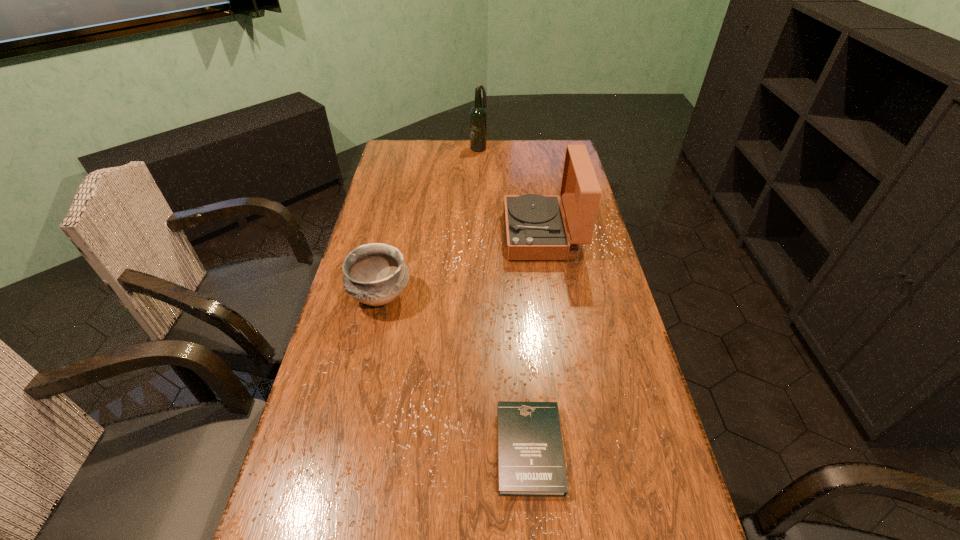
This screenshot has width=960, height=540. What are the coordinates of `free space at the far right corner` in the screenshot? It's located at (537, 146).

Identify the location of vacant region between the farthest object and the phonograph record. The height and width of the screenshot is (540, 960). (511, 191).

You are a GUI agent. You are given a task and a screenshot of the screen. Output one action in this format:
    pyautogui.click(x=<x>, y=<y>)
    Task: Click on the empty space between the shortest object and the farthest object
    The image size is (960, 540).
    Given the screenshot: What is the action you would take?
    pyautogui.click(x=504, y=298)

The height and width of the screenshot is (540, 960). Find the location of `unoccupied position between the leftmost object and the farthest object`. unoccupied position between the leftmost object and the farthest object is located at coordinates (430, 222).

This screenshot has height=540, width=960. I want to click on empty space between the second farthest object and the second nearest object, so tap(462, 266).

This screenshot has width=960, height=540. What are the coordinates of `blank region between the beer bottle and the second shortest object` in the screenshot? It's located at (430, 222).

Where is `vacant space that is in between the nearest object and the second farthest object`? This screenshot has width=960, height=540. vacant space that is in between the nearest object and the second farthest object is located at coordinates (536, 342).

In order to click on empty space between the pottery and the book in this screenshot , I will do `click(455, 373)`.

The image size is (960, 540). Find the location of `free area in between the book and the phonograph record`. free area in between the book and the phonograph record is located at coordinates (536, 342).

In order to click on vacant space that's between the leftmost object and the third object from right to left in this screenshot , I will do `click(430, 222)`.